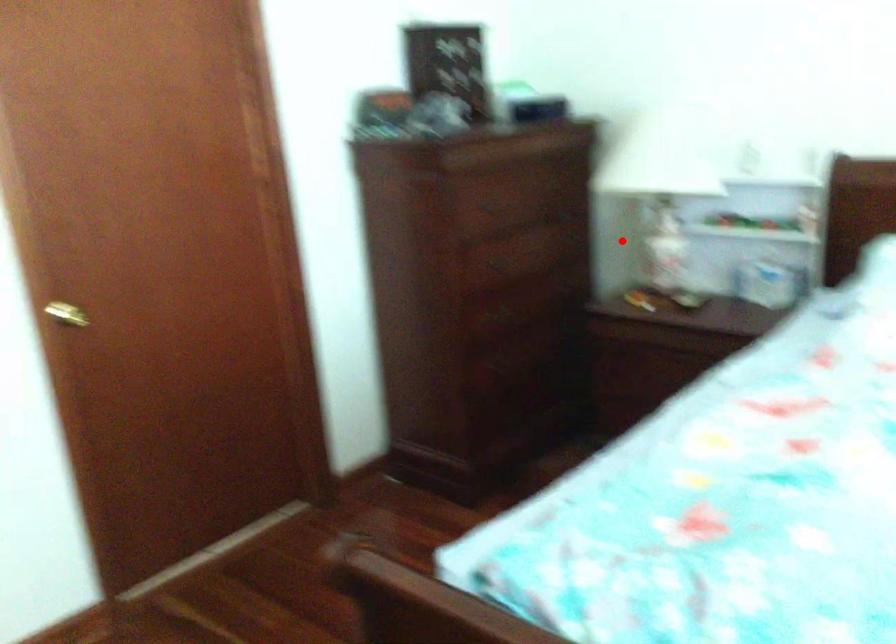
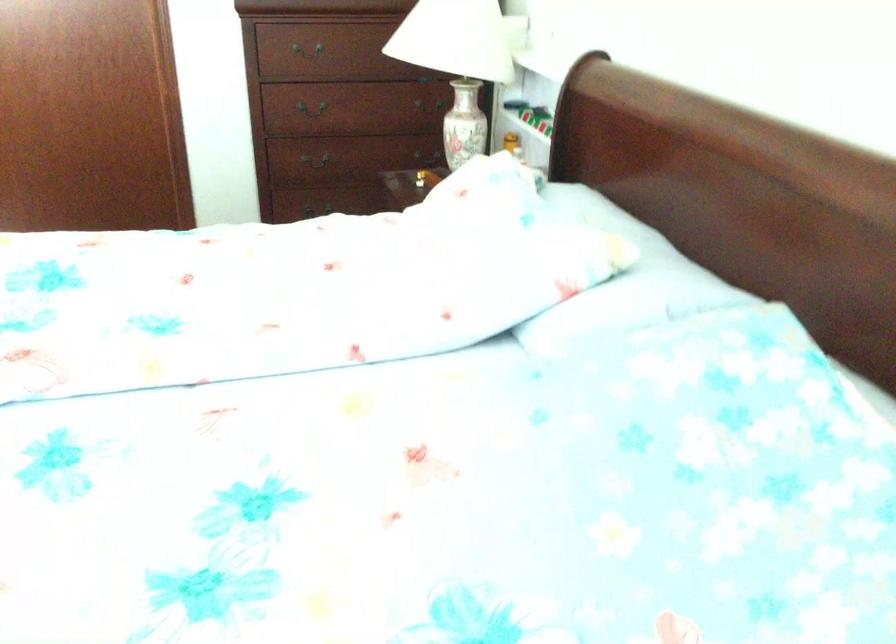
Question: A red point is marked in image1. In image2, is the corresponding 3D point closer to the camera or farther? Reply with the corresponding letter.

Choices:
 (A) The corresponding 3D point is closer.
 (B) The corresponding 3D point is farther.

Answer: (A)